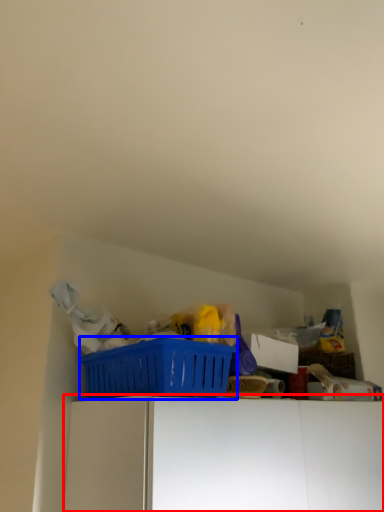
Question: Among these objects, which one is farthest to the camera, furniture (highlighted by a red box) or basket (highlighted by a blue box)?

Choices:
 (A) furniture
 (B) basket

Answer: (B)